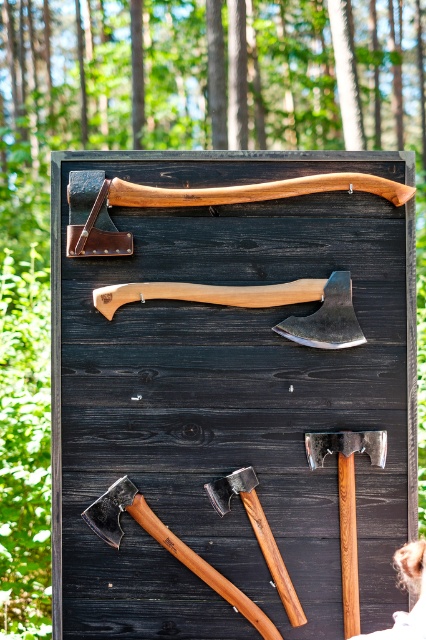
You are standing in front of a display board with axes mounted on it. You need to locate the wooden handle axe at center. Based on its coordinates, where exactly is it positioned on the board?

The wooden handle axe at center is located at the coordinates point 0.477 on the x axis and 0.610 on the y axis.

From the picture: You are an outdoor enthusiast planning to hang a new axe on the board. The new axe has a wooden handle that is the same size as the polished wood hammer at lower center. Where should you place it to ensure it doesn t block the view of the larger wooden handle at top?

Since the wooden handle at top is larger than the polished wood hammer at lower center, placing the new axe with the wooden handle of similar size to the polished wood hammer at lower center below or beside it would prevent blocking the view of the larger axe at the top.